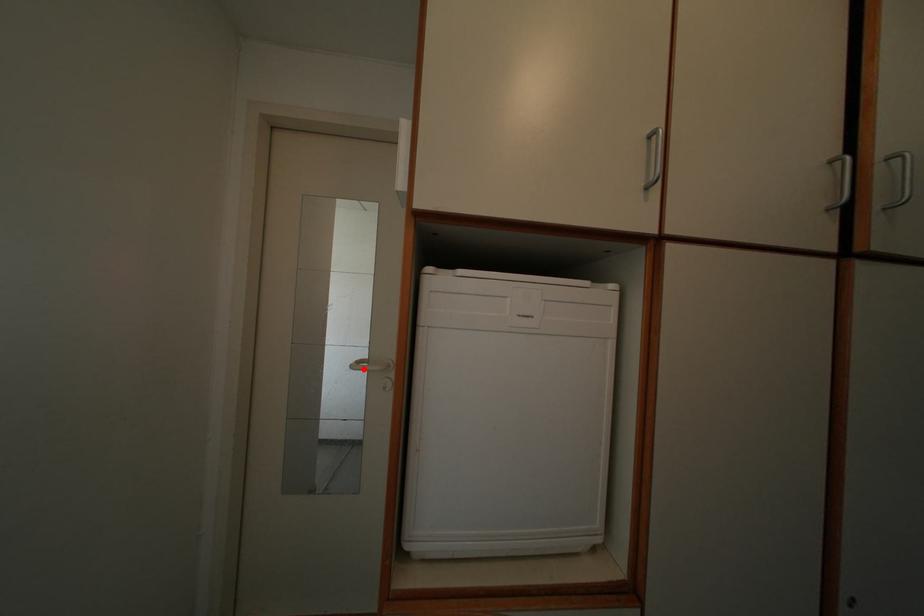
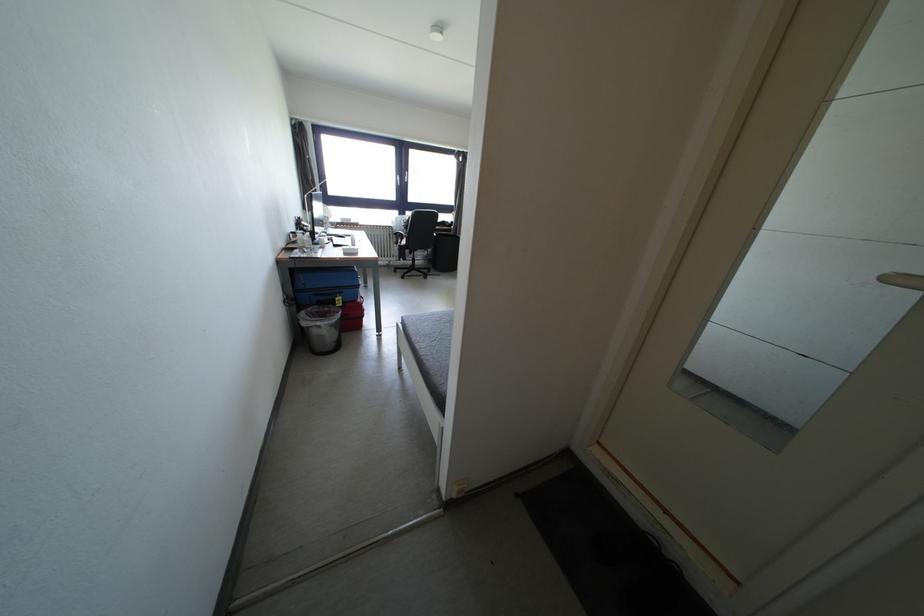
Find the pixel in the second image that matches the highlighted location in the first image.

(898, 284)